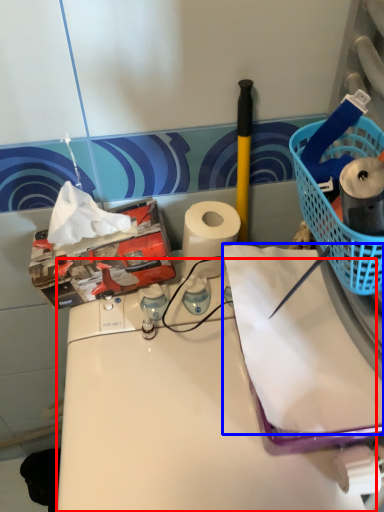
Question: Which object is closer to the camera taking this photo, counter (highlighted by a red box) or paper (highlighted by a blue box)?

Choices:
 (A) counter
 (B) paper

Answer: (A)